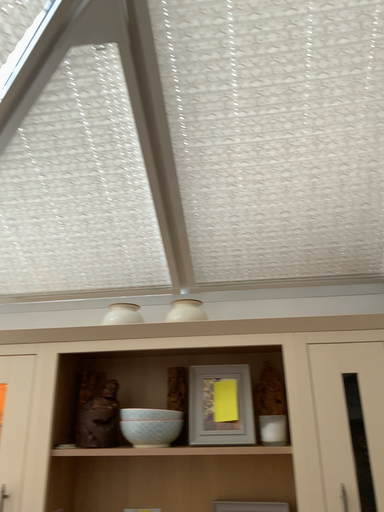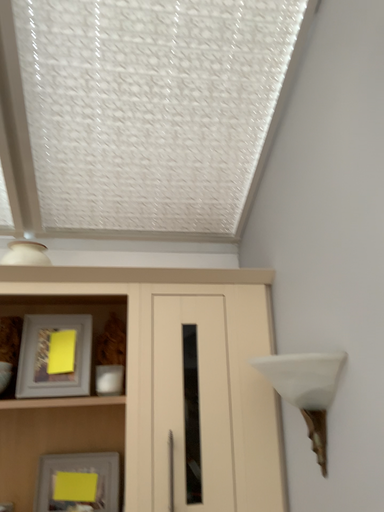
Question: Which way did the camera rotate in the video?

Choices:
 (A) rotated right
 (B) rotated left

Answer: (A)